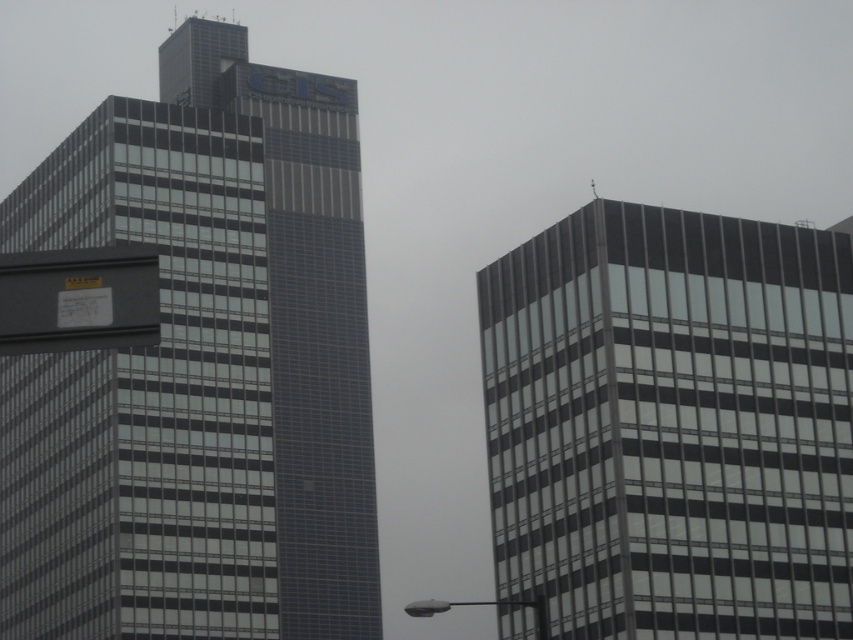
You are an architect evaluating the design of the two buildings in the image. The glassy steel skyscraper at center and the black matte sign at upper left are both part of the structure. Which one has a larger physical size?

The glassy steel skyscraper at center is bigger than the black matte sign at upper left, so the glassy steel skyscraper at center has a larger physical size.

You are a drone operator tasked with flying a drone between the two buildings. The drone has a maximum flight altitude of 150 meters. Given the scene, can you determine if the drone can safely fly between the glassy steel skyscraper at left and the glassy gray building at right without hitting either structure?

The glassy gray building at right is behind the glassy steel skyscraper at left, meaning there is no horizontal space between them for the drone to fly through. The drone cannot safely navigate between the two buildings as they are positioned one behind the other rather than side by side.

From the picture: You are standing in front of the two modern high rise buildings. You notice two points marked on the buildings. The first point is at coordinate point (194, 308) and the second is at point (78, 342). Which point is closer to you?

Point (194, 308) is further to the viewer than point (78, 342). Therefore, point (78, 342) is closer to you.